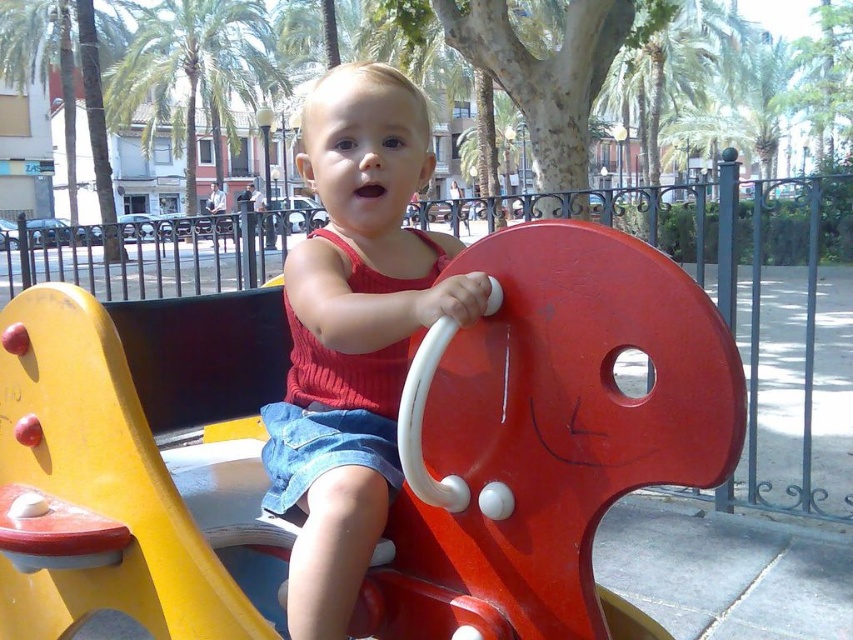
You are a parent trying to decide which toy to let your child play with first. You see the matte plastic horse at center and the matte red swing at center. Which one is physically nearer to you?

The matte plastic horse at center is closer to the viewer than the matte red swing at center, so the matte plastic horse at center is physically nearer to you.

You are standing at the camera position and want to reach the point marked as point (448,515). If you take a step forward of 28 inches, will you be able to reach it?

The distance between point (448,515) and the camera is 28.19 inches. Taking a step forward of 28 inches will bring you very close to the point, but you might need a tiny bit more movement to reach it exactly. However, practically, stepping 28 inches forward would place you near the point.